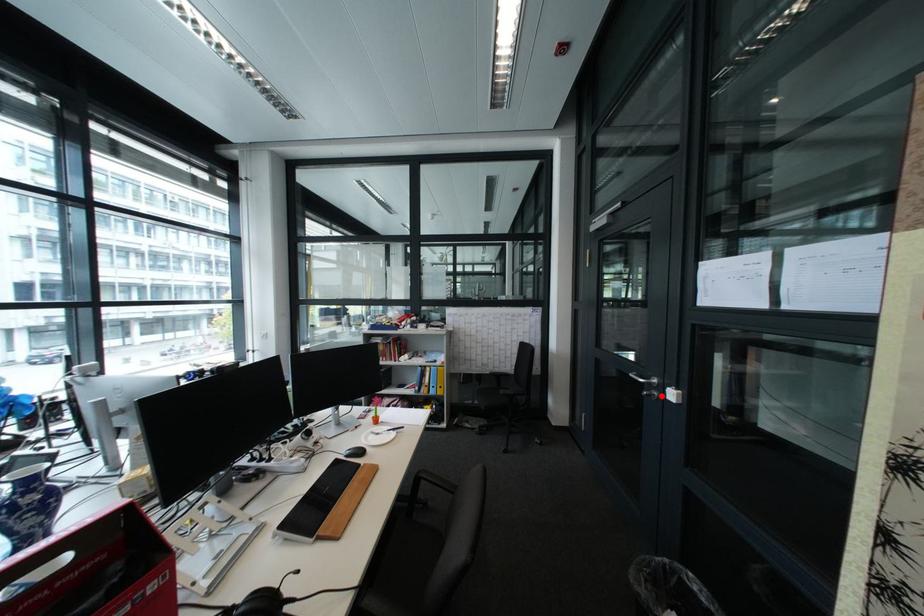
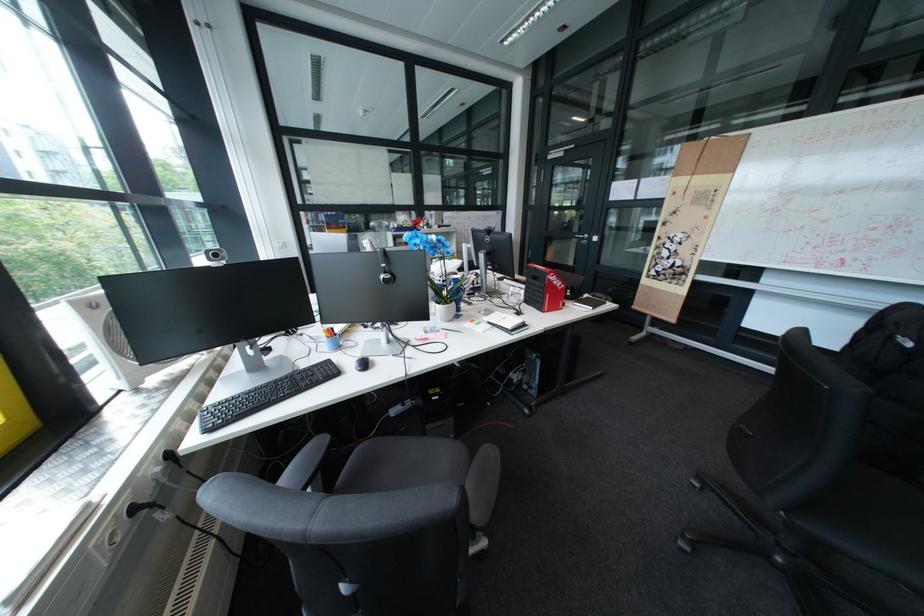
Locate, in the second image, the point that corresponds to the highlighted location in the first image.

(598, 243)